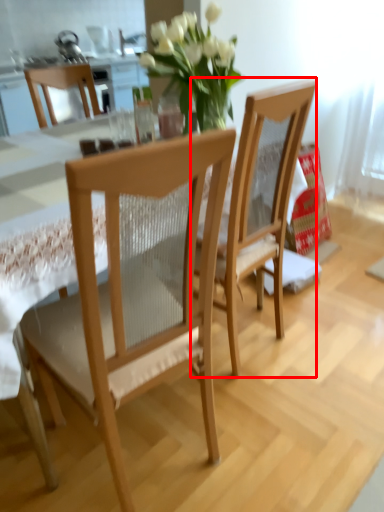
Question: From the image's perspective, what is the correct spatial positioning of chair (annotated by the red box) in reference to chair?

Choices:
 (A) below
 (B) above

Answer: (B)